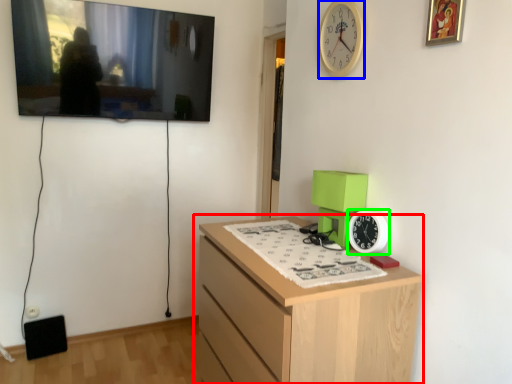
Question: Which object is positioned farthest from chest of drawers (highlighted by a red box)? Select from clock (highlighted by a blue box) and clock (highlighted by a green box).

Choices:
 (A) clock
 (B) clock

Answer: (A)